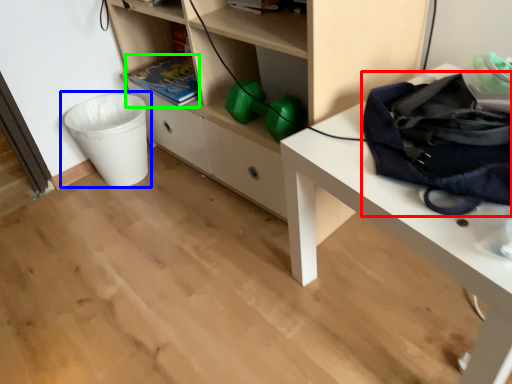
Question: Considering the real-world distances, which object is farthest from messenger bag (highlighted by a red box)? waste container (highlighted by a blue box) or book (highlighted by a green box)?

Choices:
 (A) waste container
 (B) book

Answer: (A)